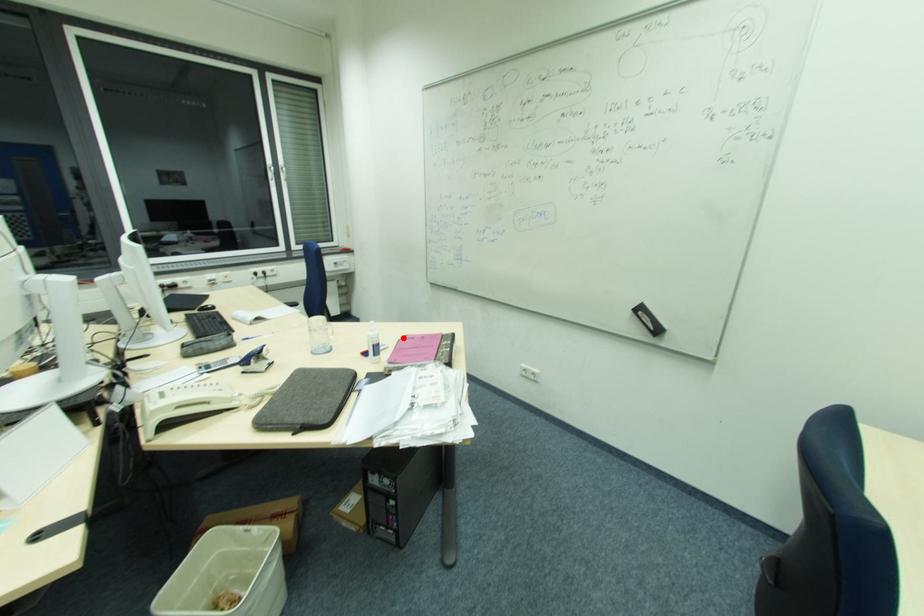
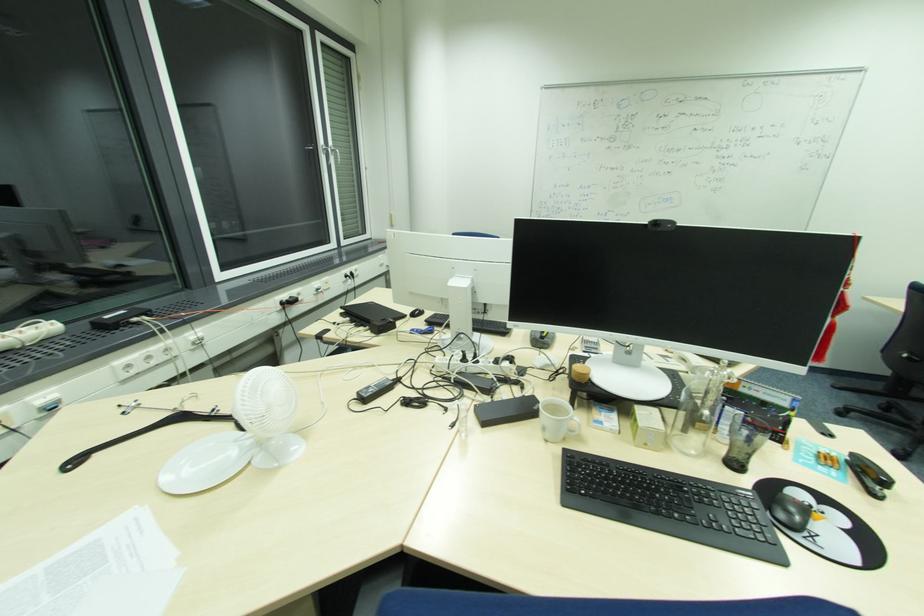
Question: A red point is marked in image1. In image2, is the corresponding 3D point closer to the camera or farther? Reply with the corresponding letter.

Choices:
 (A) The corresponding 3D point is closer.
 (B) The corresponding 3D point is farther.

Answer: (B)